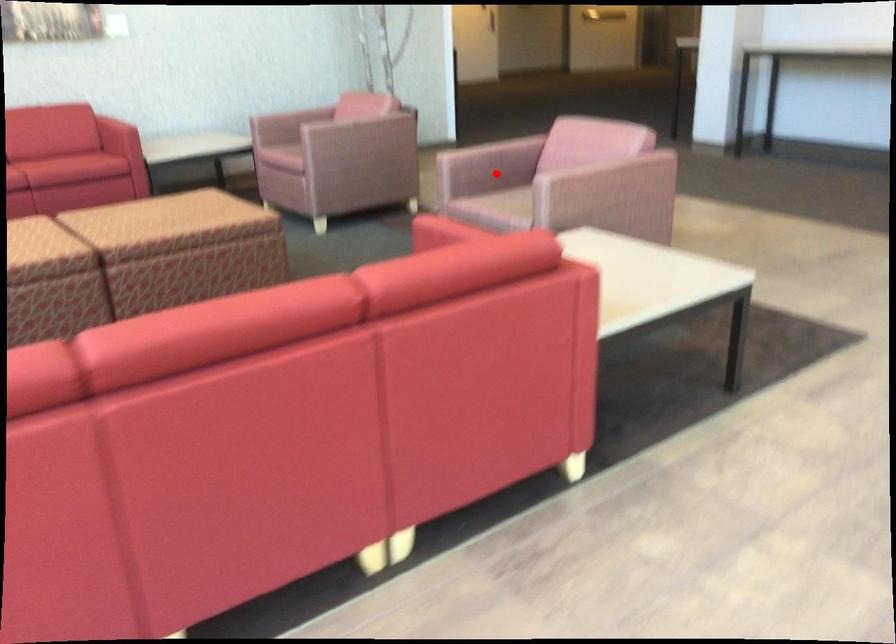
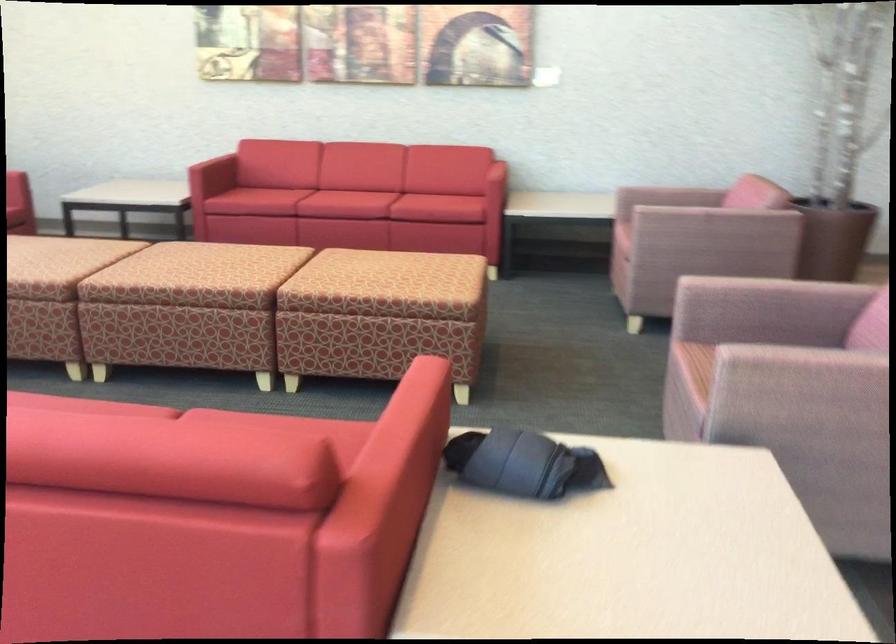
Question: A red point is marked in image1. In image2, is the corresponding 3D point closer to the camera or farther? Reply with the corresponding letter.

Choices:
 (A) The corresponding 3D point is closer.
 (B) The corresponding 3D point is farther.

Answer: (A)